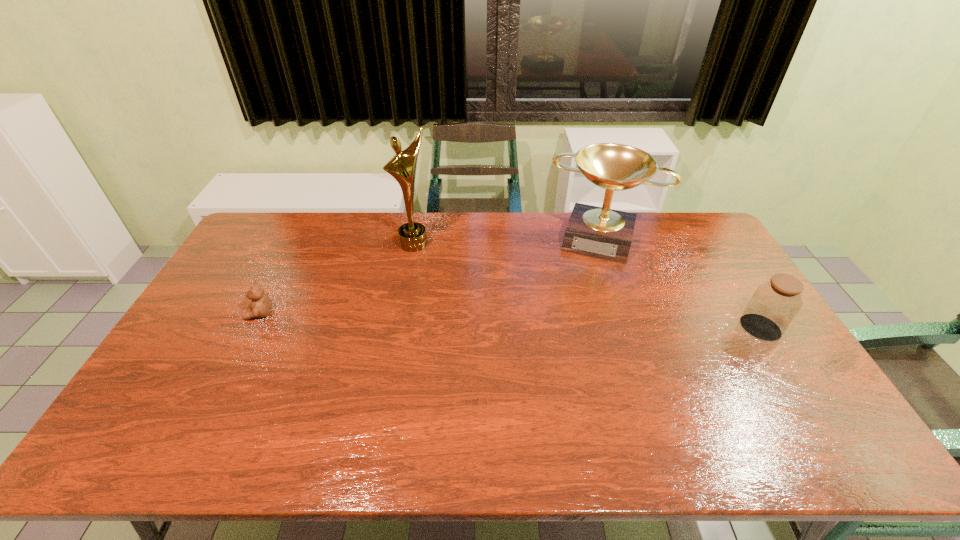
Identify the location of free space at the far edge of the desktop. This screenshot has height=540, width=960. (651, 226).

In the image, there is a desktop. Where is `vacant space at the near edge`? Image resolution: width=960 pixels, height=540 pixels. vacant space at the near edge is located at coordinates (684, 395).

Where is `free region at the right edge`? The width and height of the screenshot is (960, 540). free region at the right edge is located at coordinates (732, 262).

Identify the location of free space at the far left corner of the desktop. (246, 240).

Identify the location of vacant space that's between the jar and the leftmost object. This screenshot has width=960, height=540. (510, 321).

At what (x,y) coordinates should I click in order to perform the action: click on vacant space that's between the rightmost object and the tallest object. Please return your answer as a coordinate pair (x, y). Looking at the image, I should click on (588, 286).

Where is `free space between the third object from right to left and the rightmost object`? free space between the third object from right to left and the rightmost object is located at coordinates (588, 286).

At what (x,y) coordinates should I click in order to perform the action: click on vacant point located between the third object from left to right and the shortest object. Please return your answer as a coordinate pair (x, y). Looking at the image, I should click on (431, 276).

Locate an element on the screen. This screenshot has height=540, width=960. free spot between the right award and the jar is located at coordinates (681, 283).

Locate an element on the screen. The width and height of the screenshot is (960, 540). free space that is in between the right award and the leftmost object is located at coordinates (431, 276).